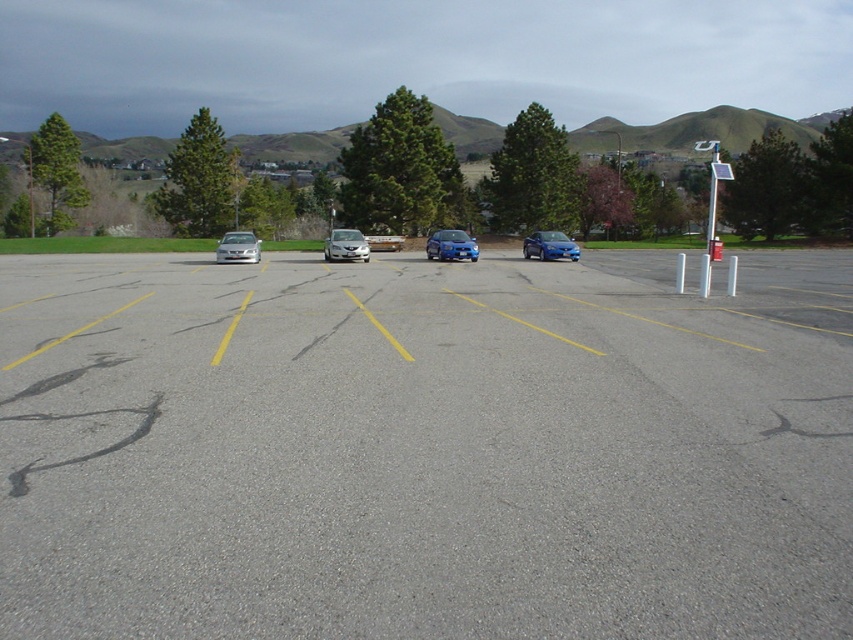
Question: Is gray asphalt parking lot at center bigger than silver metallic sedan at left?

Choices:
 (A) no
 (B) yes

Answer: (B)

Question: Which of the following is the closest to the observer?

Choices:
 (A) (224, 241)
 (B) (358, 252)
 (C) (601, 540)
 (D) (524, 257)

Answer: (C)

Question: Which is nearer to the satin blue sedan at center?

Choices:
 (A) gray asphalt parking lot at center
 (B) metallic silver car at center
 (C) metallic blue sedan at center

Answer: (C)

Question: Estimate the real-world distances between objects in this image. Which object is farther from the satin silver sedan at center?

Choices:
 (A) satin blue sedan at center
 (B) silver metallic sedan at left
 (C) metallic blue sedan at center
 (D) metallic silver car at center

Answer: (D)

Question: Considering the relative positions of gray asphalt parking lot at center and silver metallic sedan at left in the image provided, where is gray asphalt parking lot at center located with respect to silver metallic sedan at left?

Choices:
 (A) below
 (B) above

Answer: (A)

Question: Is metallic silver car at center in front of metallic blue sedan at center?

Choices:
 (A) yes
 (B) no

Answer: (B)